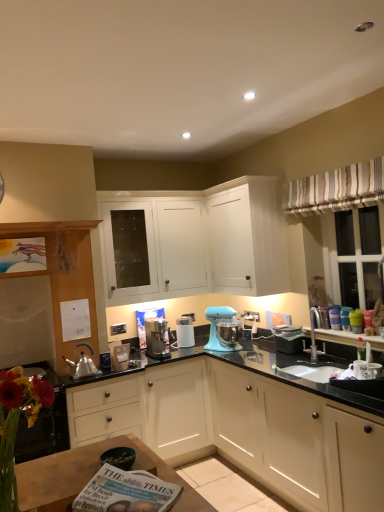
Question: Is point (71, 460) closer or farther from the camera than point (54, 280)?

Choices:
 (A) closer
 (B) farther

Answer: (A)

Question: Considering the positions of wooden table at lower left and matte white cabinet at left, the 3th cabinetry in the top-to-bottom sequence, in the image, is wooden table at lower left wider or thinner than matte white cabinet at left, the 3th cabinetry in the top-to-bottom sequence,?

Choices:
 (A) wide
 (B) thin

Answer: (A)

Question: Which is nearer to the white matte cabinet at center, positioned as the first cabinetry in bottom-to-top order?

Choices:
 (A) matte white cabinet at left, arranged as the second cabinetry when ordered from the bottom
 (B) wooden table at lower left
 (C) printed paper magazine at lower center
 (D) striped fabric curtain at upper right
 (E) light blue plastic stand mixer at center

Answer: (E)

Question: Which object is positioned farthest from the printed paper magazine at lower center?

Choices:
 (A) striped fabric curtain at upper right
 (B) matte white cabinet at left, the 3th cabinetry in the top-to-bottom sequence
 (C) vibrant bouquet at lower left
 (D) light blue plastic stand mixer at center
 (E) shiny silver tea pot at left

Answer: (D)